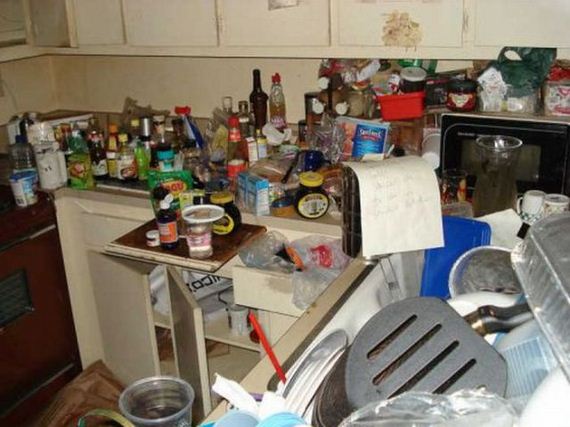
Where is `empty glass vase`? Image resolution: width=570 pixels, height=427 pixels. empty glass vase is located at coordinates (494, 188).